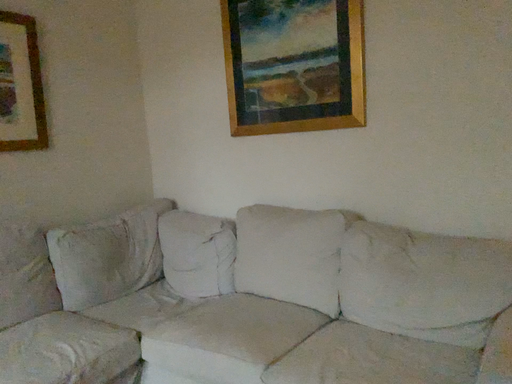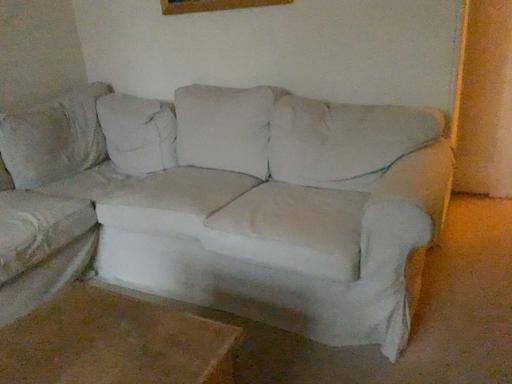
Question: How did the camera likely rotate when shooting the video?

Choices:
 (A) rotated right
 (B) rotated left

Answer: (A)